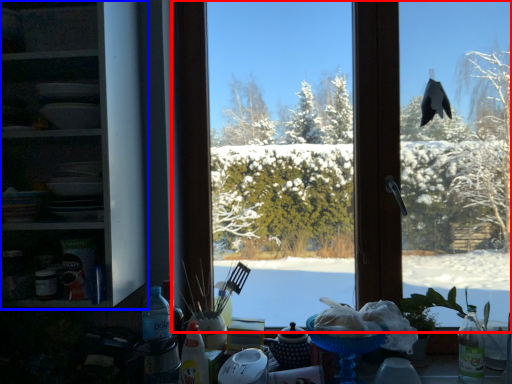
Question: Which object is further to the camera taking this photo, window (highlighted by a red box) or shelf (highlighted by a blue box)?

Choices:
 (A) window
 (B) shelf

Answer: (A)